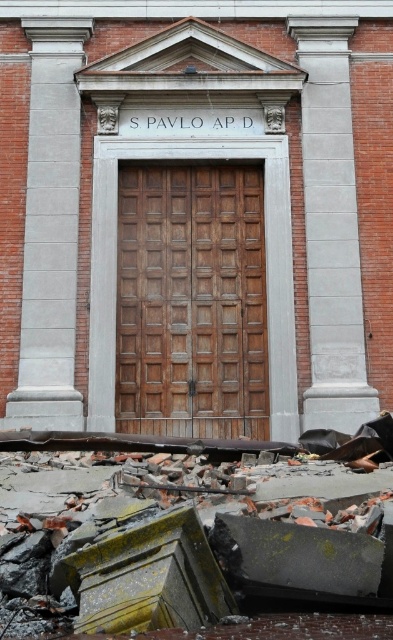
Who is shorter, wooden panelled door at center or gray concrete column at right?

Standing shorter between the two is wooden panelled door at center.

Does point (121, 276) come closer to viewer compared to point (303, 112)?

Yes.

Which is in front, point (141, 419) or point (319, 349)?

Point (319, 349) is in front.

What are the coordinates of `wooden panelled door at center` in the screenshot? It's located at (190, 301).

Consider the image. Can you confirm if gray concrete column at left is positioned below gray concrete column at right?

Yes.

Measure the distance between gray concrete column at left and camera.

The distance of gray concrete column at left from camera is 104.97 feet.

Locate an element on the screen. This screenshot has width=393, height=640. gray concrete column at left is located at coordinates (49, 230).

Who is more distant from viewer, (128, 166) or (71, 426)?

The point (128, 166) is behind.

Does point (119, 241) come farther from viewer compared to point (40, 410)?

Yes.

Between point (264, 305) and point (55, 141), which one is positioned behind?

The point (55, 141) is more distant.

Identify the location of wooden panelled door at center. This screenshot has width=393, height=640. (190, 301).